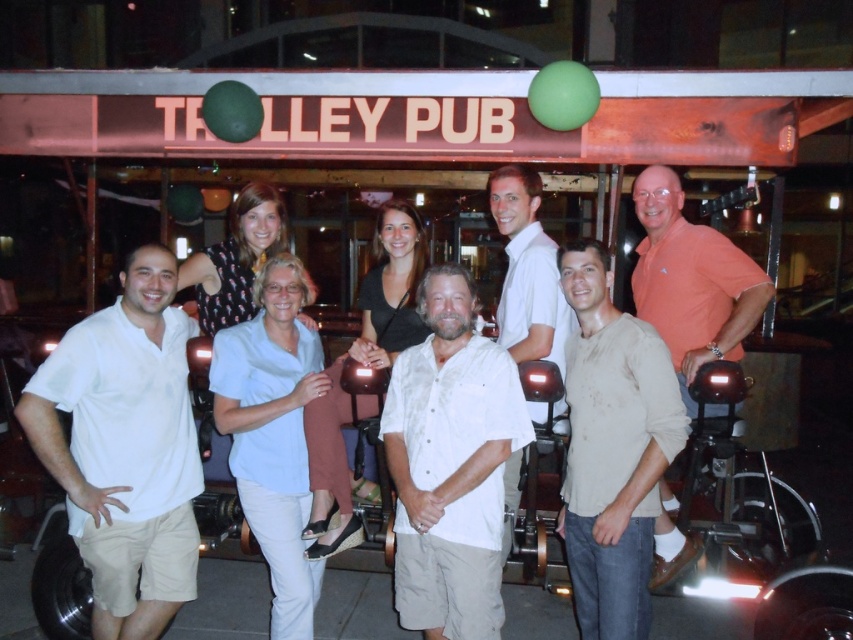
Is point (403, 616) closer to camera compared to point (264, 355)?

That is True.

Is white textured shirt at center further to camera compared to light blue cotton shirt at center?

No, white textured shirt at center is in front of light blue cotton shirt at center.

Does point (444, 582) come behind point (265, 276)?

That is False.

Locate an element on the screen. The height and width of the screenshot is (640, 853). white textured shirt at center is located at coordinates (450, 465).

Can you confirm if white textured shirt at center is wider than white cotton shirt at center?

Indeed, white textured shirt at center has a greater width compared to white cotton shirt at center.

Is point (436, 468) in front of point (535, 284)?

Yes, point (436, 468) is in front of point (535, 284).

At what (x,y) coordinates should I click in order to perform the action: click on white textured shirt at center. Please return your answer as a coordinate pair (x, y). The width and height of the screenshot is (853, 640). Looking at the image, I should click on (450, 465).

Does light beige cotton shirt at center lie in front of light blue cotton shirt at center?

That is True.

This screenshot has width=853, height=640. What do you see at coordinates (612, 449) in the screenshot? I see `light beige cotton shirt at center` at bounding box center [612, 449].

Is point (621, 509) positioned after point (271, 266)?

No, (621, 509) is closer to viewer.

This screenshot has height=640, width=853. I want to click on light beige cotton shirt at center, so click(612, 449).